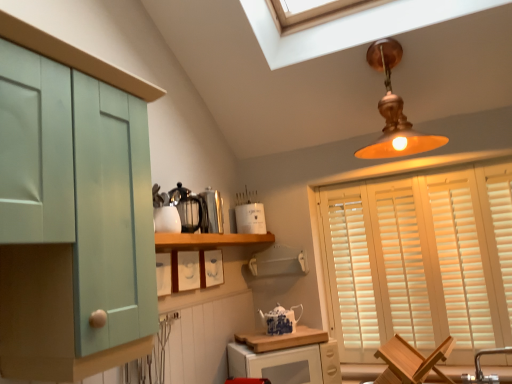
Question: Can you confirm if metallic silver kettle at center, which is counted as the 2th appliance, starting from the front, is bigger than blue and white porcelain teapot at center?

Choices:
 (A) yes
 (B) no

Answer: (A)

Question: Is metallic silver kettle at center, placed as the 2th appliance when sorted from back to front, wider than blue and white porcelain teapot at center?

Choices:
 (A) yes
 (B) no

Answer: (A)

Question: Is metallic silver kettle at center, which is counted as the 2th appliance, starting from the front, to the left of blue and white porcelain teapot at center from the viewer's perspective?

Choices:
 (A) no
 (B) yes

Answer: (B)

Question: From the image's perspective, is metallic silver kettle at center, placed as the 2th appliance when sorted from back to front, beneath blue and white porcelain teapot at center?

Choices:
 (A) no
 (B) yes

Answer: (A)

Question: Is metallic silver kettle at center, placed as the 2th appliance when sorted from back to front, outside blue and white porcelain teapot at center?

Choices:
 (A) yes
 (B) no

Answer: (A)

Question: Is metallic silver kettle at center, placed as the 2th appliance when sorted from back to front, closer to the viewer compared to blue and white porcelain teapot at center?

Choices:
 (A) no
 (B) yes

Answer: (B)

Question: Can you confirm if white matte container at upper center, arranged as the first appliance when viewed from the back, is smaller than white wooden blinds at right?

Choices:
 (A) no
 (B) yes

Answer: (B)

Question: Considering the relative positions of white matte container at upper center, the third appliance when ordered from front to back, and white wooden blinds at right in the image provided, is white matte container at upper center, the third appliance when ordered from front to back, in front of white wooden blinds at right?

Choices:
 (A) no
 (B) yes

Answer: (A)

Question: Considering the relative sizes of white matte container at upper center, the third appliance when ordered from front to back, and white wooden blinds at right in the image provided, is white matte container at upper center, the third appliance when ordered from front to back, thinner than white wooden blinds at right?

Choices:
 (A) no
 (B) yes

Answer: (A)

Question: Is white matte container at upper center, the third appliance when ordered from front to back, not inside white wooden blinds at right?

Choices:
 (A) yes
 (B) no

Answer: (A)

Question: Is the position of white matte container at upper center, the third appliance when ordered from front to back, more distant than that of white wooden blinds at right?

Choices:
 (A) yes
 (B) no

Answer: (A)

Question: Could white wooden blinds at right be considered to be inside white matte container at upper center, the third appliance when ordered from front to back?

Choices:
 (A) no
 (B) yes

Answer: (A)

Question: Is wooden cutting board at lower center further to camera compared to metallic silver kettle at center, which is counted as the 2th appliance, starting from the front?

Choices:
 (A) yes
 (B) no

Answer: (A)